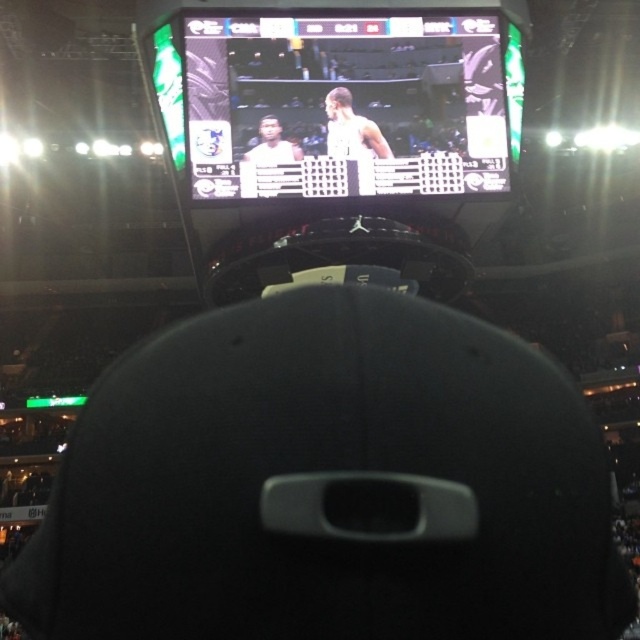
You are standing in the arena and want to know how far you are from the point marked at coordinates (250,163). Can you determine the distance?

The point marked at coordinates (250,163) is 34.82 meters away from you.

You are sitting in the arena and want to check the score on the matte black screen at upper center. Where should you look to find it?

The matte black screen at upper center is located at point (353, 104), so you should look towards that coordinate to find the score.